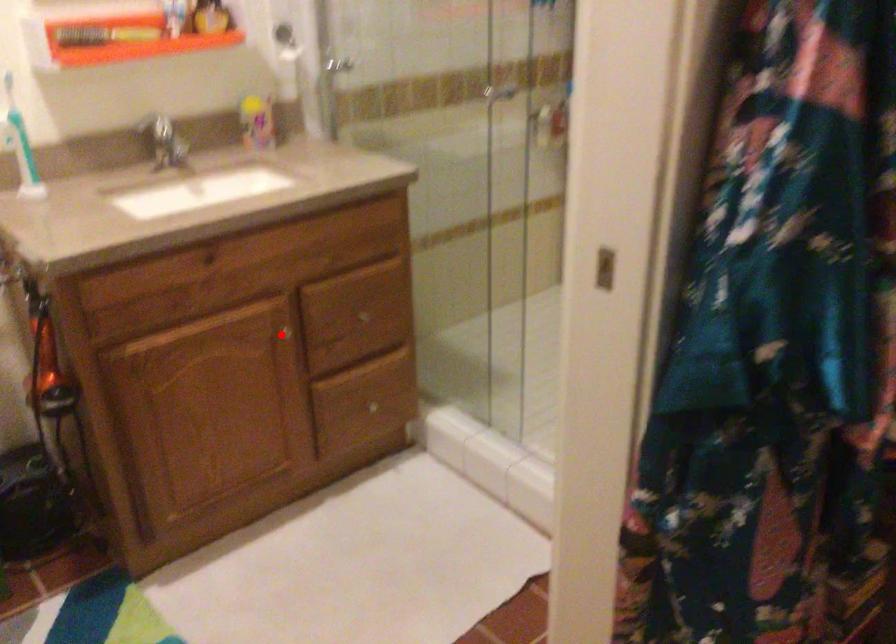
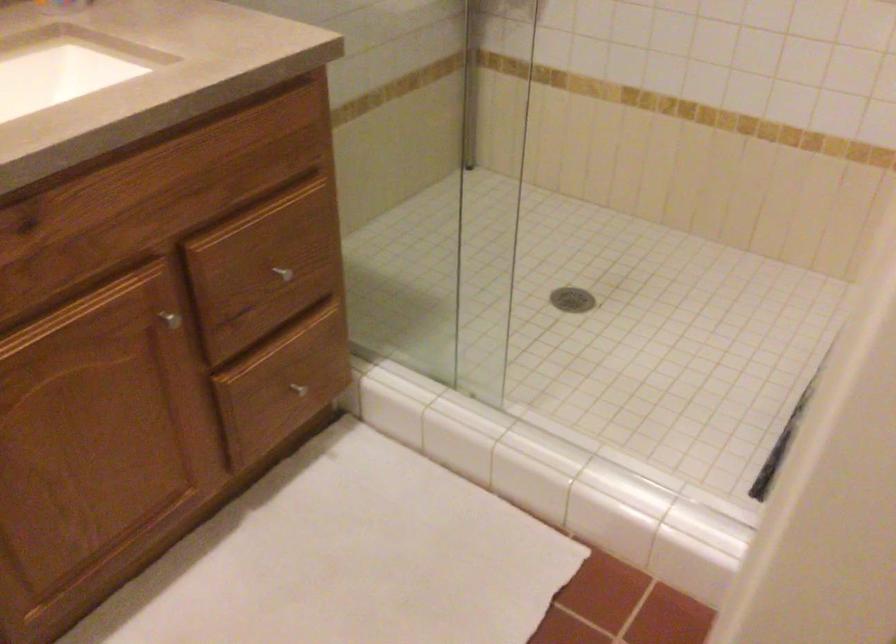
Question: I am providing you with two images of the same scene from different viewpoints. A red point is shown in image1. For the corresponding object point in image2, is it positioned nearer or farther from the camera?

Choices:
 (A) Nearer
 (B) Farther

Answer: (A)